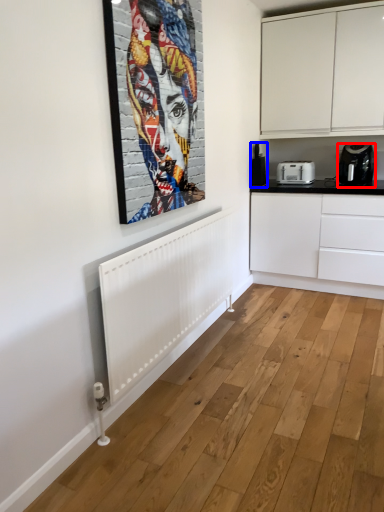
Question: Which object appears farthest to the camera in this image, home appliance (highlighted by a red box) or coffee machine (highlighted by a blue box)?

Choices:
 (A) home appliance
 (B) coffee machine

Answer: (B)